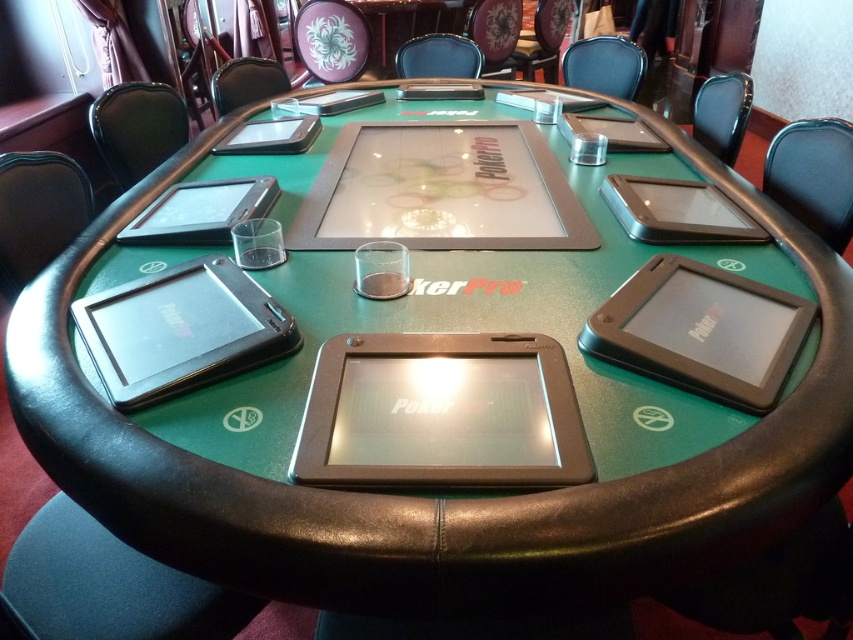
You are a player at the PokerPro table and want to place your bet. The dealer has instructed you to place your chips at the silver metallic tablet at upper right located at point (677, 211). However, you are currently at position A, which is at point 0.123, 0.456. Can you reach the silver metallic tablet at upper right without crossing the center of the table? Please explain your reasoning.

The silver metallic tablet at upper right is located at point (677, 211), and your current position is at point 0.123, 0.456. Since the table is circular, moving from position A to the tablet would require moving along the edge of the table. The center of the table is at point 0.5, 0.5. The straight line between your position and the tablet does not pass through the center because the tablet is in the upper right quadrant and your position is lower left. Therefore, you can reach the tablet without passing

You are a player sitting at the PokerPro table and want to place your chips between the silver metallic tablet at upper right and the matte black tablet at upper right. Can you fit your chips there?

The silver metallic tablet at upper right is located below the matte black tablet at upper right, so there is space between them for placing chips.